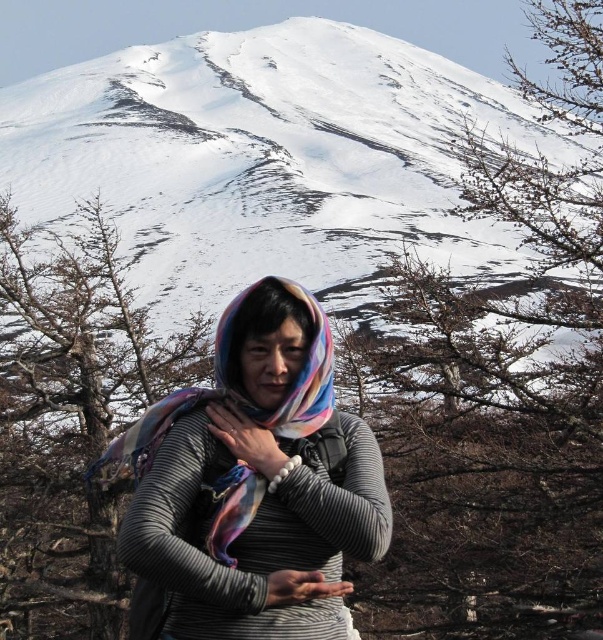
Looking at this image, does snowy white mountain at upper center have a smaller size compared to multicolored scarf at center?

Incorrect, snowy white mountain at upper center is not smaller in size than multicolored scarf at center.

Between point (384, 104) and point (343, 508), which one is positioned in front?

Point (343, 508)

I want to click on snowy white mountain at upper center, so click(270, 160).